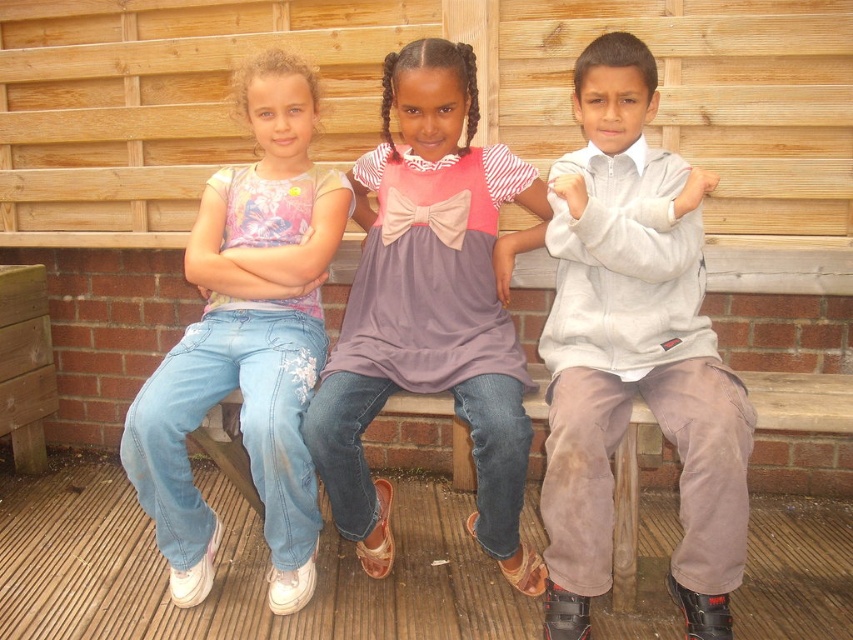
Question: Does pink satin dress at center appear under light blue denim jeans at left?

Choices:
 (A) yes
 (B) no

Answer: (A)

Question: Which of these objects is positioned closest to the light blue denim jeans at left?

Choices:
 (A) pink satin dress at center
 (B) light gray fleece jacket at center

Answer: (A)

Question: Can you confirm if pink satin dress at center is positioned below light blue denim jeans at left?

Choices:
 (A) no
 (B) yes

Answer: (B)

Question: Which object is farther from the camera taking this photo?

Choices:
 (A) light gray fleece jacket at center
 (B) pink satin dress at center
 (C) light blue denim jeans at left

Answer: (C)

Question: Can you confirm if light gray fleece jacket at center is positioned below light blue denim jeans at left?

Choices:
 (A) yes
 (B) no

Answer: (A)

Question: Which point appears closest to the camera in this image?

Choices:
 (A) (611, 285)
 (B) (485, 404)

Answer: (B)